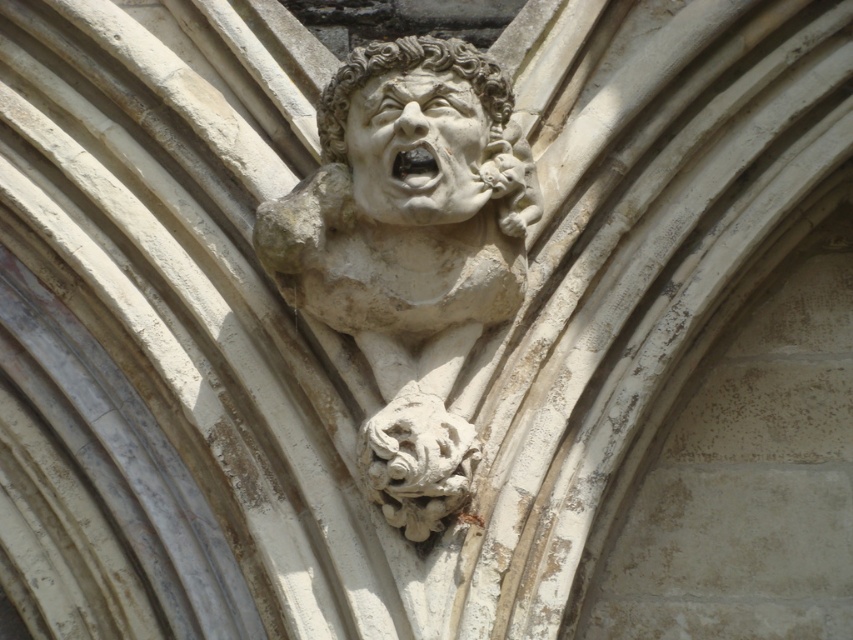
Question: Which point appears closest to the camera in this image?

Choices:
 (A) (451, 134)
 (B) (434, 209)

Answer: (B)

Question: Which object appears closest to the camera in this image?

Choices:
 (A) smooth stone face at upper center
 (B) white stone gargoyle at center

Answer: (B)

Question: Can you confirm if white stone gargoyle at center is positioned to the right of smooth stone face at upper center?

Choices:
 (A) yes
 (B) no

Answer: (B)

Question: Observing the image, what is the correct spatial positioning of white stone gargoyle at center in reference to smooth stone face at upper center?

Choices:
 (A) above
 (B) below

Answer: (B)

Question: Which object appears farthest from the camera in this image?

Choices:
 (A) smooth stone face at upper center
 (B) white stone gargoyle at center

Answer: (A)

Question: Does white stone gargoyle at center have a lesser width compared to smooth stone face at upper center?

Choices:
 (A) yes
 (B) no

Answer: (B)